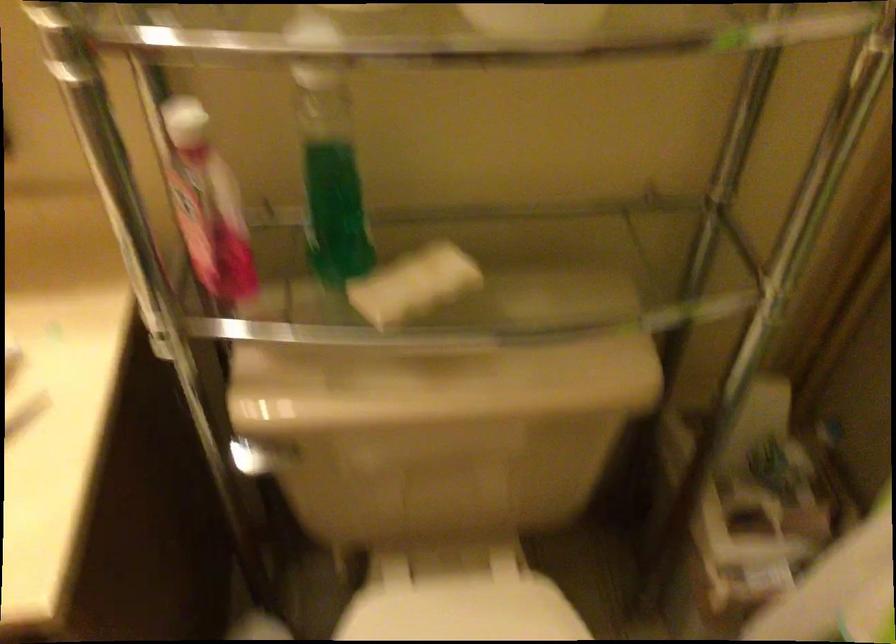
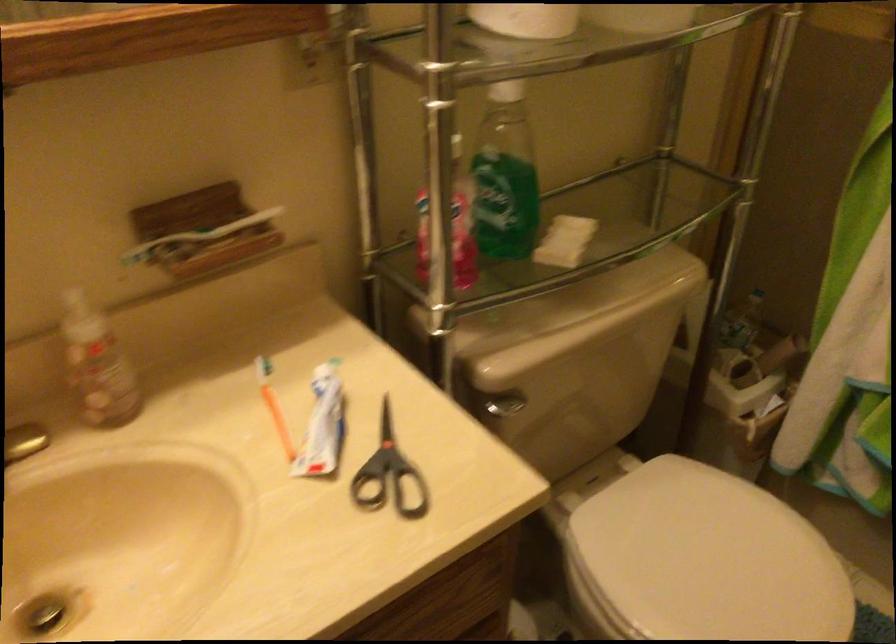
Locate, in the second image, the point that corresponds to the point at 194,219 in the first image.

(449, 227)